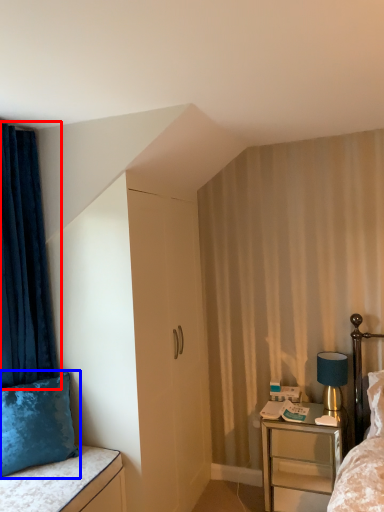
Question: Which of the following is the farthest to the observer, curtain (highlighted by a red box) or pillow (highlighted by a blue box)?

Choices:
 (A) curtain
 (B) pillow

Answer: (A)